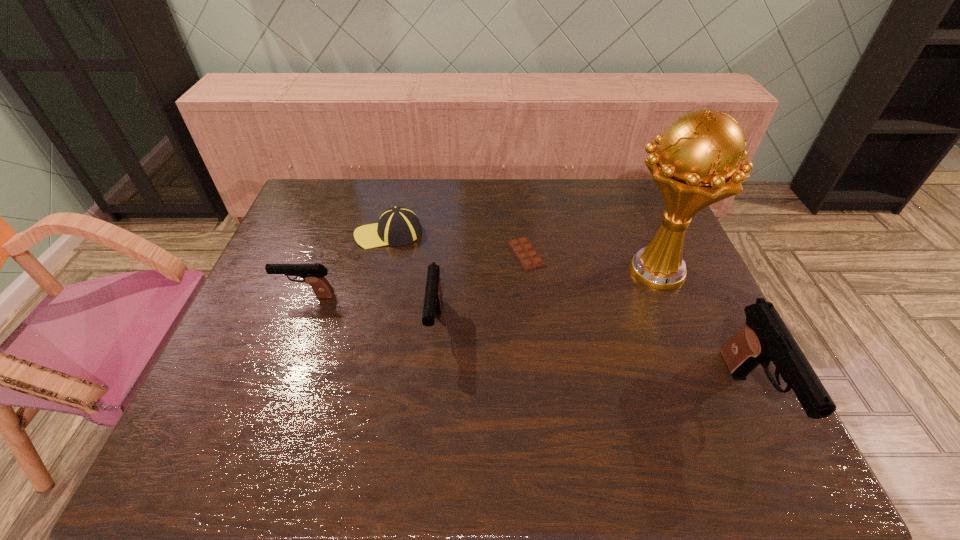
The width and height of the screenshot is (960, 540). I want to click on chocolate bar, so click(528, 257).

The height and width of the screenshot is (540, 960). Find the location of `free spot located 0.070m at the barrel of the shortest pistol`. free spot located 0.070m at the barrel of the shortest pistol is located at coordinates (252, 296).

Where is `vacant space situated 0.070m at the barrel of the shortest pistol`? This screenshot has height=540, width=960. vacant space situated 0.070m at the barrel of the shortest pistol is located at coordinates (252, 296).

Find the location of a particular element. This screenshot has height=540, width=960. free region located 0.070m at the barrel of the shortest pistol is located at coordinates (252, 296).

Locate an element on the screen. The width and height of the screenshot is (960, 540). vacant region located at the barrel of the second tallest pistol is located at coordinates (430, 379).

You are a GUI agent. You are given a task and a screenshot of the screen. Output one action in this format:
    pyautogui.click(x=<x>, y=<y>)
    Task: Click on the free space located at the front of the trophy_cup where the globe is prominent
    
    Given the screenshot: What is the action you would take?
    pyautogui.click(x=578, y=271)

You are a GUI agent. You are given a task and a screenshot of the screen. Output one action in this format:
    pyautogui.click(x=<x>, y=<y>)
    Task: Click on the vacant space located 0.190m at the front of the trophy_cup where the globe is prominent
    Image resolution: width=960 pixels, height=540 pixels.
    Given the screenshot: What is the action you would take?
    pyautogui.click(x=546, y=271)

At what (x,y) coordinates should I click in order to perform the action: click on vacant space located at the front of the trophy_cup where the globe is prominent. Please return your answer as a coordinate pair (x, y). The image size is (960, 540). Looking at the image, I should click on (472, 271).

Locate an element on the screen. vacant space located with the brim of the fifth object from right to left facing forward is located at coordinates (281, 234).

Find the location of a particular element. vacant space located 0.060m with the brim of the fifth object from right to left facing forward is located at coordinates (336, 234).